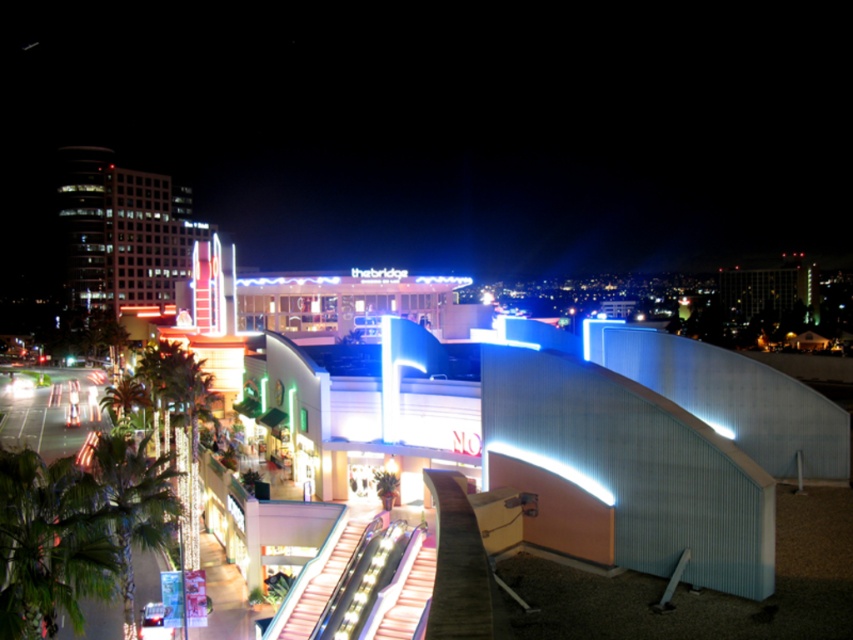
Question: Which point is farther to the camera?

Choices:
 (A) (267, 628)
 (B) (149, 176)

Answer: (B)

Question: Can you confirm if glassy white building at upper left is positioned to the right of metallic silver escalator at center?

Choices:
 (A) no
 (B) yes

Answer: (A)

Question: Is glassy white building at upper left smaller than metallic silver escalator at center?

Choices:
 (A) yes
 (B) no

Answer: (B)

Question: Which object appears farthest from the camera in this image?

Choices:
 (A) glassy white building at upper left
 (B) metallic silver escalator at center

Answer: (A)

Question: Which of the following is the closest to the observer?

Choices:
 (A) (289, 595)
 (B) (68, 209)

Answer: (A)

Question: Does glassy white building at upper left have a greater width compared to metallic silver escalator at center?

Choices:
 (A) no
 (B) yes

Answer: (B)